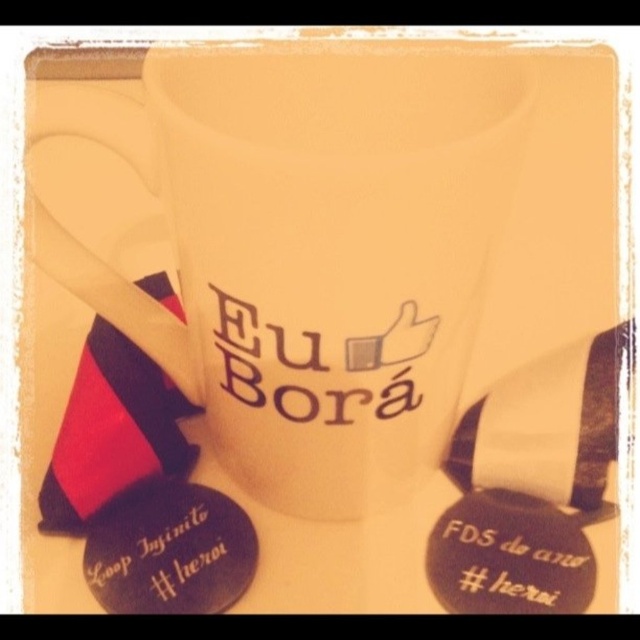
At what (x,y) coordinates should I click in order to perform the action: click on black matte badge at lower left. Please return your answer as a coordinate pair (x, y). Image resolution: width=640 pixels, height=640 pixels. Looking at the image, I should click on (170, 552).

Is black matte badge at lower left in front of black matte badge at lower right?

Yes, it is in front of black matte badge at lower right.

Find the location of a particular element. black matte badge at lower left is located at coordinates (170, 552).

Between white matte mug at center and black matte badge at lower right, which one is positioned higher?

white matte mug at center is above.

Between white matte mug at center and black matte badge at lower right, which one appears on the right side from the viewer's perspective?

Positioned to the right is black matte badge at lower right.

This screenshot has width=640, height=640. What do you see at coordinates (307, 248) in the screenshot?
I see `white matte mug at center` at bounding box center [307, 248].

At what (x,y) coordinates should I click in order to perform the action: click on white matte mug at center. Please return your answer as a coordinate pair (x, y). Looking at the image, I should click on (307, 248).

Does white matte mug at center appear on the right side of black matte badge at lower left?

Yes, white matte mug at center is to the right of black matte badge at lower left.

Can you confirm if white matte mug at center is taller than black matte badge at lower left?

Correct, white matte mug at center is much taller as black matte badge at lower left.

Find the location of a particular element. white matte mug at center is located at coordinates (307, 248).